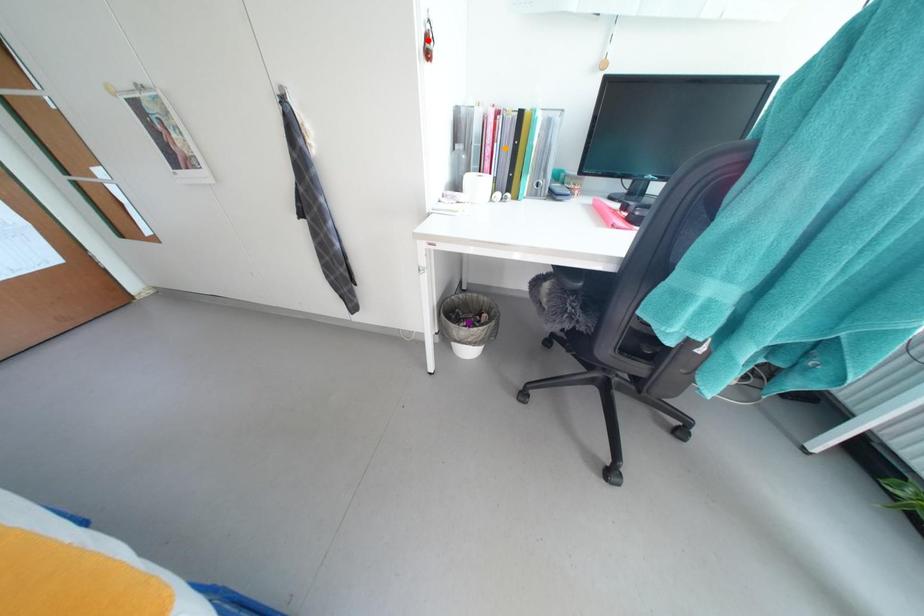
Order these from nearest to farthest:
orange point
red point
purple point

purple point
orange point
red point